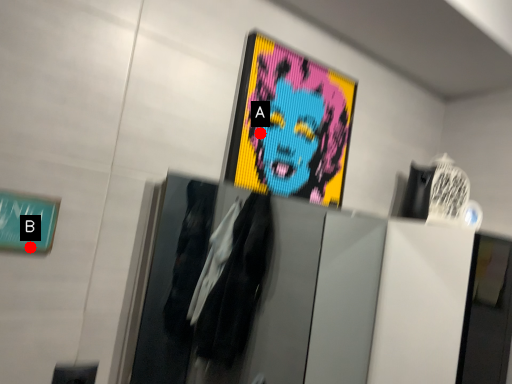
Question: Two points are circled on the image, labeled by A and B beside each circle. Among these points, which one is farthest from the camera?

Choices:
 (A) A is further
 (B) B is further

Answer: (A)